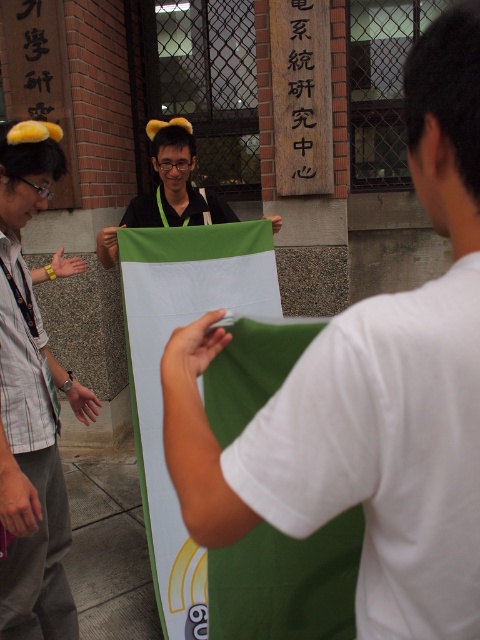
You are planning to hang a new banner that is 2 meters wide. You have two options in front of you, the matte green fabric at center and the green matte flag at center. Based on their sizes, which one should you choose to ensure it can cover the 2 meter width?

The green matte flag at center has a greater width than the matte green fabric at center. Since the green matte flag at center is wider, it would be the better choice to cover the 2 meter width requirement.

You are organizing an outdoor event and need to decide which object to use as a backdrop. The matte green fabric at center and the green matte flag at center are available. Which one would you choose if you want a larger backdrop?

The matte green fabric at center has a larger size compared to the green matte flag at center, so it would be the better choice for a larger backdrop.